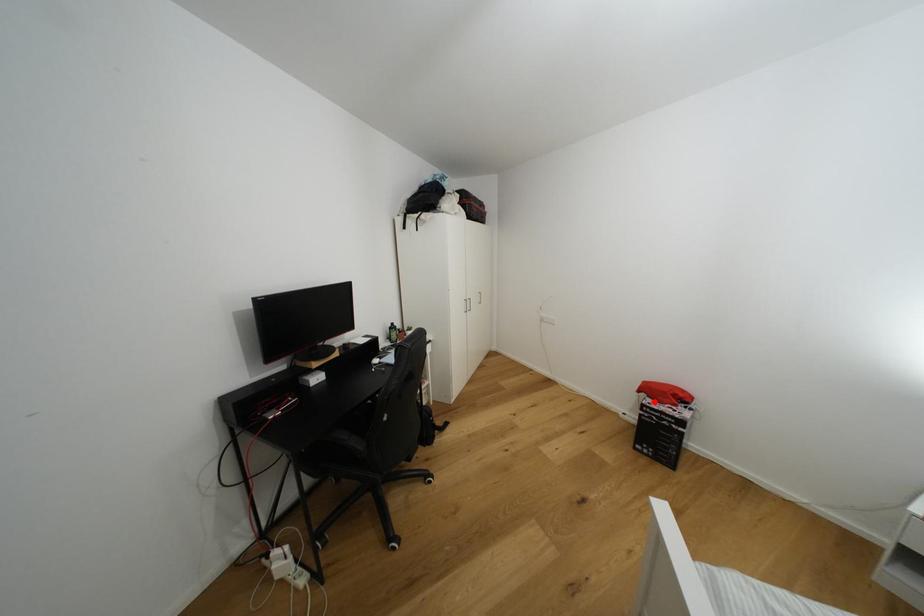
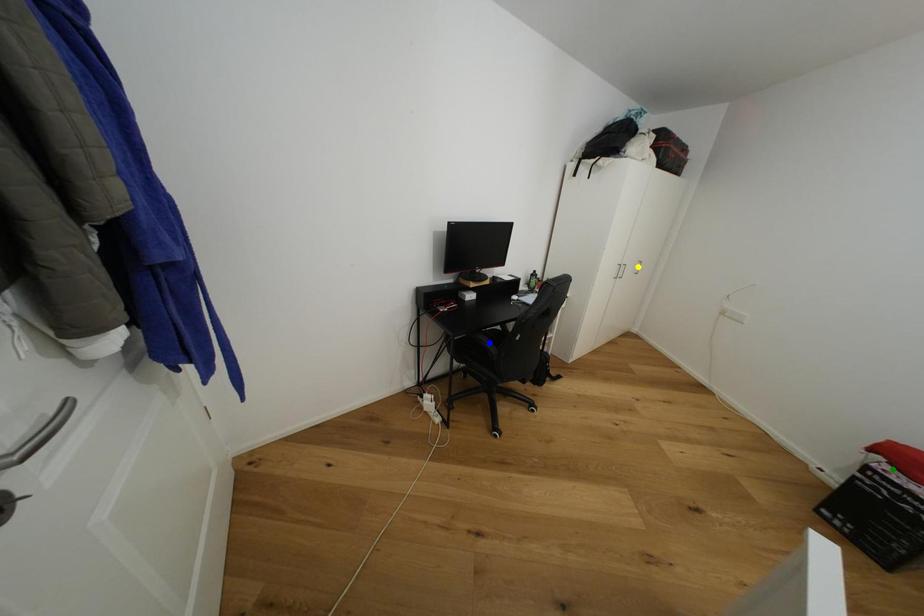
Question: I am providing you with two images of the same scene from different viewpoints. A red point is marked on the first image. You are given multiple points on the second image. Which point in image 2 is actually the same real-world point as the red point in image 1?

Choices:
 (A) yellow point
 (B) blue point
 (C) green point

Answer: (C)